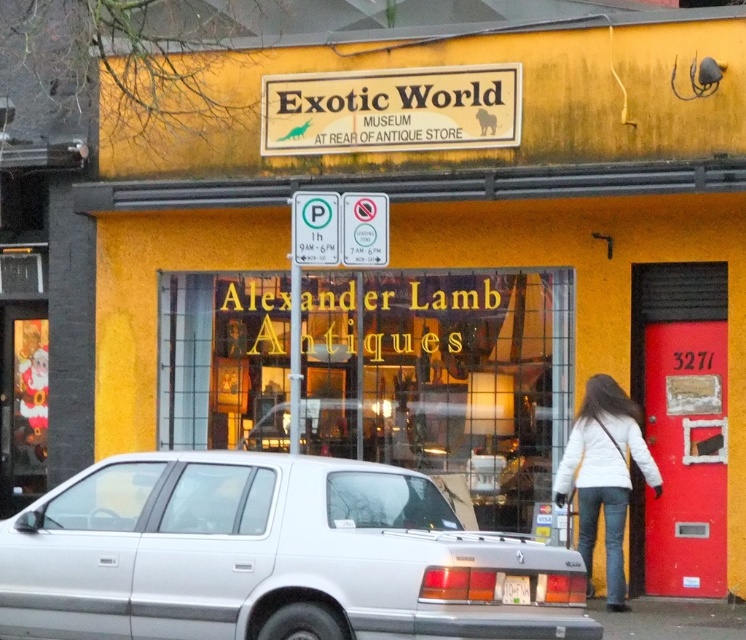
You are a delivery person who needs to park your van in front of the building. The van is 2 meters tall. Can you safely park your van next to the silver metallic sedan at lower center without hitting the white plastic license plate at rear?

The silver metallic sedan at lower center is much taller than the white plastic license plate at rear. Since the van is 2 meters tall, it might be too tall compared to the license plate height, so parking next to it could risk hitting the license plate.

You are standing in front of the building and notice the white matte jacket at lower right. Based on its position, can you determine if the jacket is closer to the red door with the number 3271 or to the large glass window displaying Alexander Lamb Antiques?

The white matte jacket at lower right is located at point (604, 476), which places it closer to the red door with the number 3271 than to the large glass window displaying Alexander Lamb Antiques.